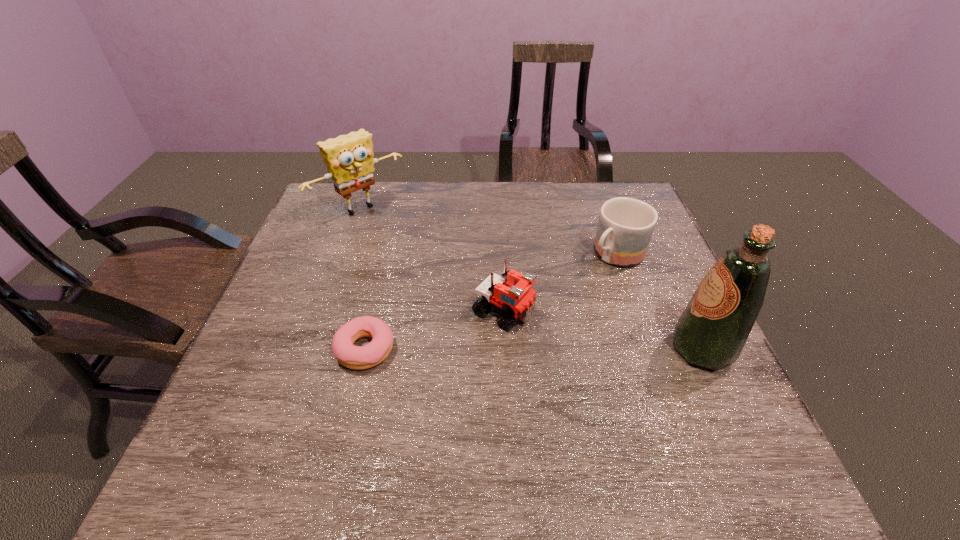
At what (x,y) coordinates should I click in order to perform the action: click on vacant position in the image that satisfies the following two spatial constraints: 1. on the back side of the shortest object; 2. on the front-facing side of the olive oil. Please return your answer as a coordinate pair (x, y). The width and height of the screenshot is (960, 540). Looking at the image, I should click on (366, 349).

Identify the location of free location that satisfies the following two spatial constraints: 1. on the front side of the olive oil; 2. on the front-facing side of the fourth shortest object. This screenshot has width=960, height=540. click(312, 349).

This screenshot has height=540, width=960. I want to click on vacant point that satisfies the following two spatial constraints: 1. on the back side of the olive oil; 2. on the front-facing side of the shortest object, so click(366, 349).

Image resolution: width=960 pixels, height=540 pixels. In order to click on vacant region that satisfies the following two spatial constraints: 1. on the back side of the second farthest object; 2. on the left side of the shortest object in this screenshot , I will do `click(388, 255)`.